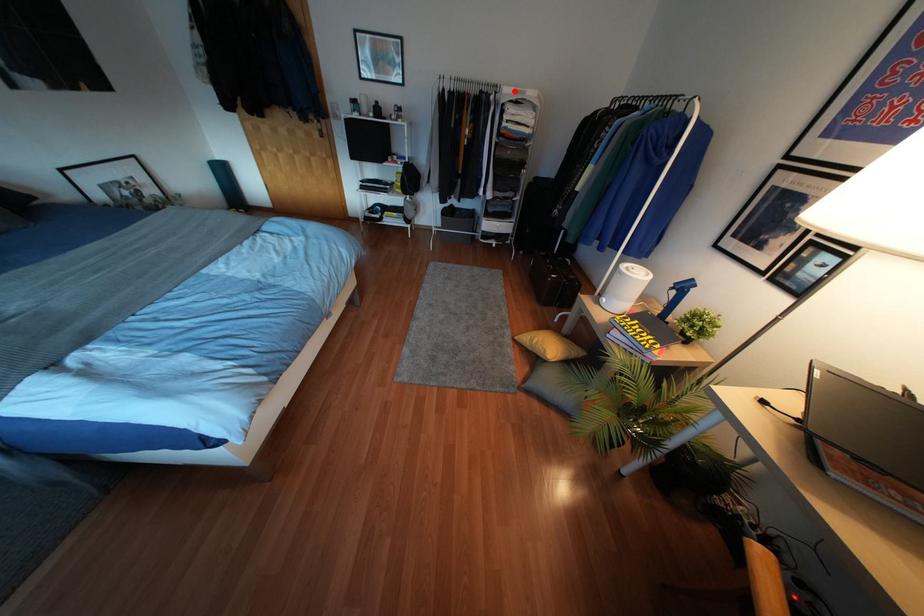
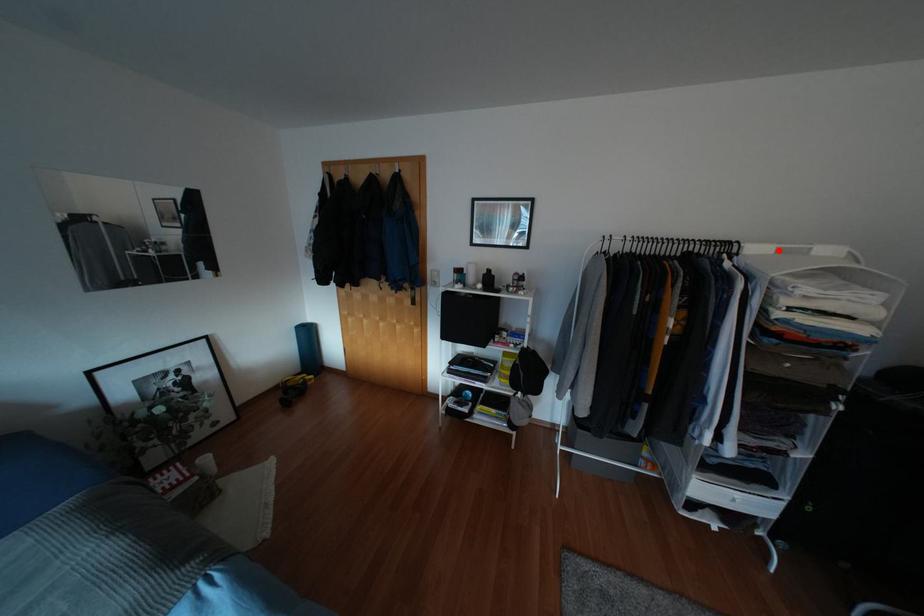
I am providing you with two images of the same scene from different viewpoints. A red point is marked on the first image and another point is marked on the second image. Do the highlighted points in image1 and image2 indicate the same real-world spot?

Yes